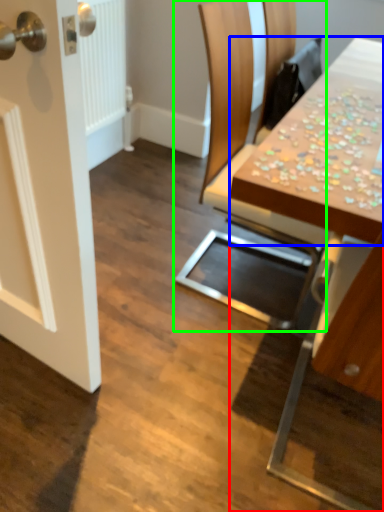
Question: Based on their relative distances, which object is nearer to table (highlighted by a red box)? Choose from counter top (highlighted by a blue box) and chair (highlighted by a green box).

Choices:
 (A) counter top
 (B) chair

Answer: (A)